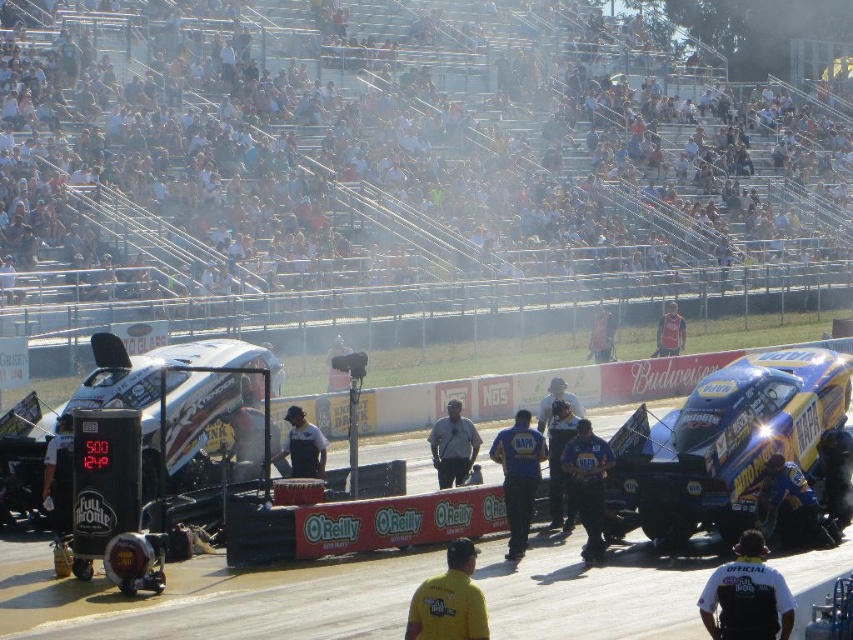
Question: Can you confirm if white fabric shirt at lower right is thinner than gray fabric shirt at center?

Choices:
 (A) no
 (B) yes

Answer: (A)

Question: Which point is farther to the camera?

Choices:
 (A) blue glossy race car at center
 (B) white fabric shirt at lower right
 (C) blue fabric shirt at center

Answer: (A)

Question: Which point is farther to the camera?

Choices:
 (A) white fabric shirt at lower right
 (B) gray fabric shirt at center

Answer: (B)

Question: Which of the following is the closest to the observer?

Choices:
 (A) [x=558, y=38]
 (B) [x=438, y=419]

Answer: (B)

Question: Can you confirm if silver metallic car at center is bigger than blue fabric shirt at center?

Choices:
 (A) yes
 (B) no

Answer: (B)

Question: Where is blue glossy race car at center located in relation to gray fabric shirt at center in the image?

Choices:
 (A) left
 (B) right

Answer: (B)